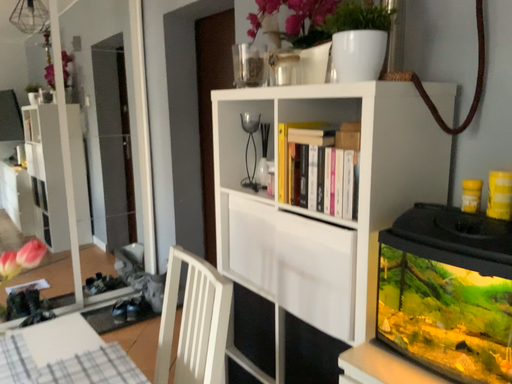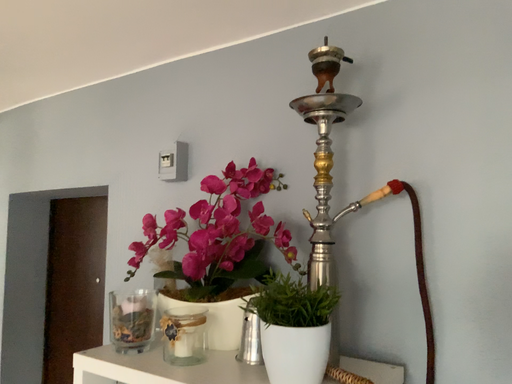
Question: Which way did the camera rotate in the video?

Choices:
 (A) rotated left
 (B) rotated right

Answer: (B)